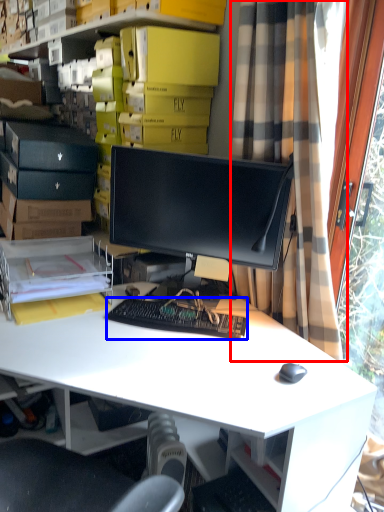
Question: Which of the following is the closest to the observer, curtain (highlighted by a red box) or computer keyboard (highlighted by a blue box)?

Choices:
 (A) curtain
 (B) computer keyboard

Answer: (A)